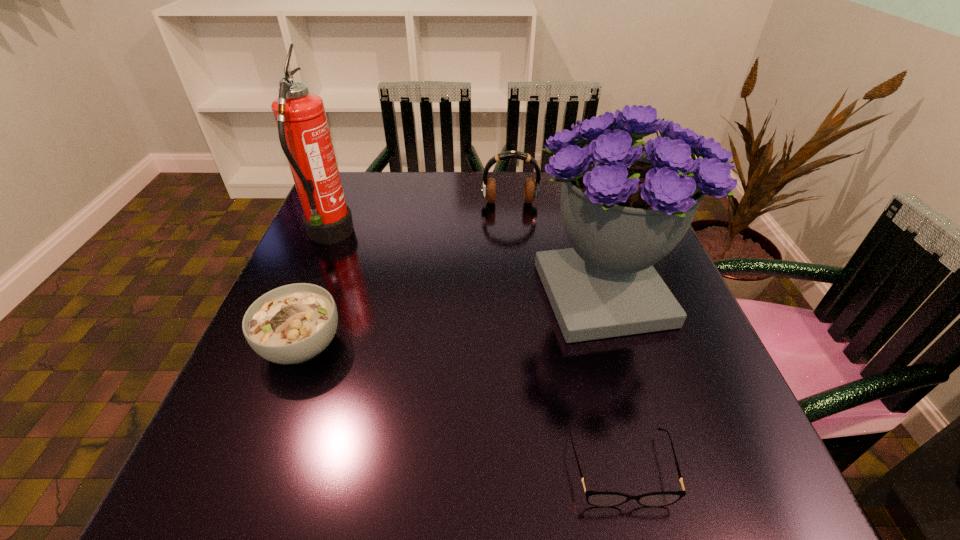
The image size is (960, 540). In order to click on free space that satisfies the following two spatial constraints: 1. on the front-facing side of the fire extinguisher; 2. on the left side of the bouquet in this screenshot , I will do `click(305, 294)`.